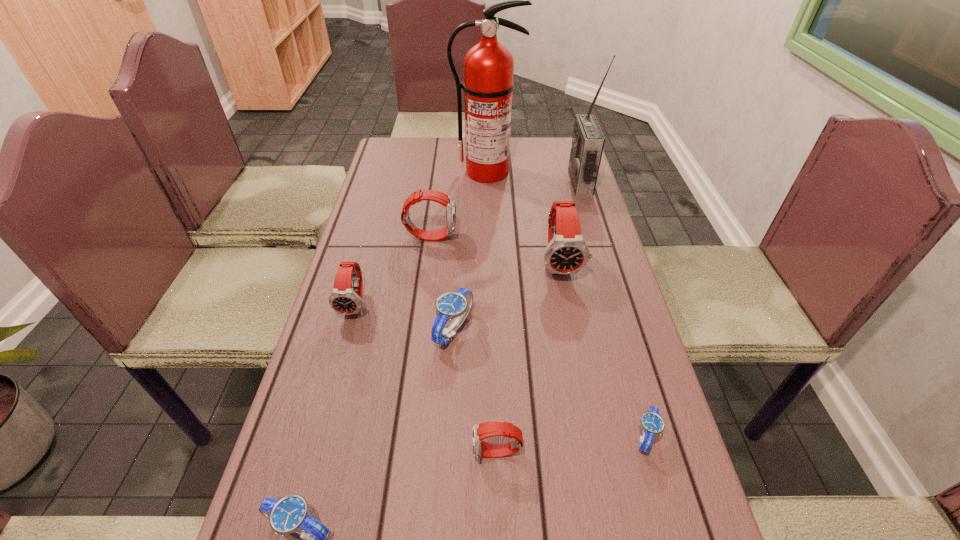
The width and height of the screenshot is (960, 540). Find the location of `vacant point that satisfies the following two spatial constraints: 1. on the face of the shortest watch; 2. on the right side of the tallest watch`. vacant point that satisfies the following two spatial constraints: 1. on the face of the shortest watch; 2. on the right side of the tallest watch is located at coordinates 593,436.

Identify the location of free space in the image that satisfies the following two spatial constraints: 1. on the face of the second blue watch from left to right; 2. on the left side of the third biggest red watch. (349, 329).

This screenshot has height=540, width=960. Find the location of `vacant space that satisfies the following two spatial constraints: 1. on the display of the radio receiver; 2. on the face of the third tallest watch`. vacant space that satisfies the following two spatial constraints: 1. on the display of the radio receiver; 2. on the face of the third tallest watch is located at coordinates (617, 304).